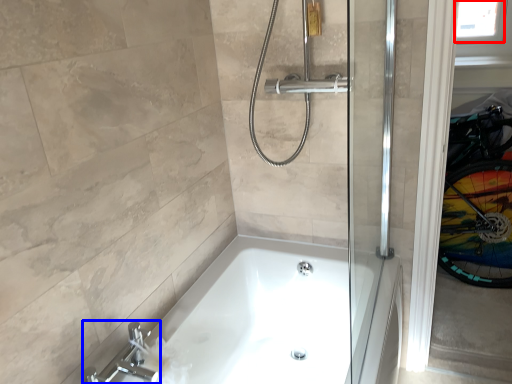
Question: Which object appears closest to the camera in this image, window screen (highlighted by a red box) or tap (highlighted by a blue box)?

Choices:
 (A) window screen
 (B) tap

Answer: (B)